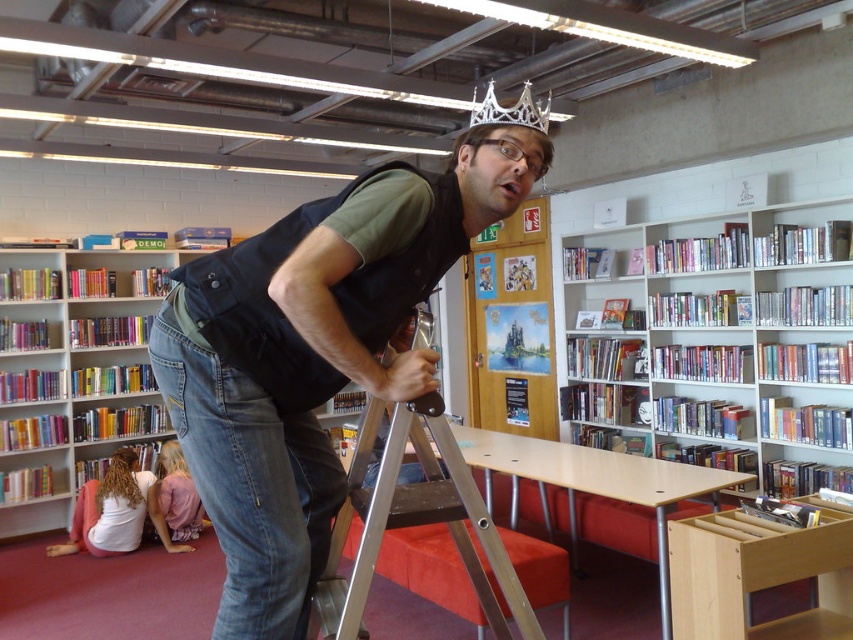
Can you confirm if white glossy bookcase at upper center is shorter than silver metallic crown at upper center?

No, white glossy bookcase at upper center is not shorter than silver metallic crown at upper center.

Can you confirm if white glossy bookcase at upper center is thinner than silver metallic crown at upper center?

Incorrect, white glossy bookcase at upper center's width is not less than silver metallic crown at upper center's.

Between point (674, 400) and point (497, 122), which one is positioned in front?

Point (497, 122)

Locate an element on the screen. The width and height of the screenshot is (853, 640). white glossy bookcase at upper center is located at coordinates (738, 337).

Between point (479, 579) and point (535, 144), which one is positioned in front?

Point (535, 144) is in front.

In the scene shown: Which is above, silver metallic ladder at center or silver metallic crown at center?

silver metallic crown at center is higher up.

Describe the element at coordinates (415, 520) in the screenshot. I see `silver metallic ladder at center` at that location.

Find the location of a particular element. silver metallic ladder at center is located at coordinates (415, 520).

Measure the distance between matte black vest at center and multicolored plastic bookcase at lower left.

The distance of matte black vest at center from multicolored plastic bookcase at lower left is 15.36 feet.

Does point (248, 266) lie behind point (53, 358)?

No.

This screenshot has height=640, width=853. I want to click on matte black vest at center, so click(x=312, y=355).